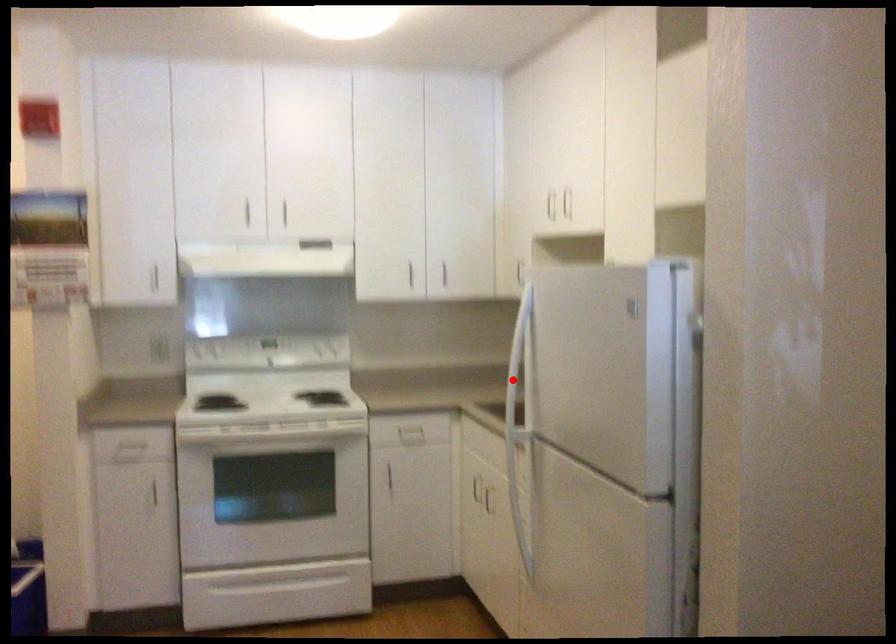
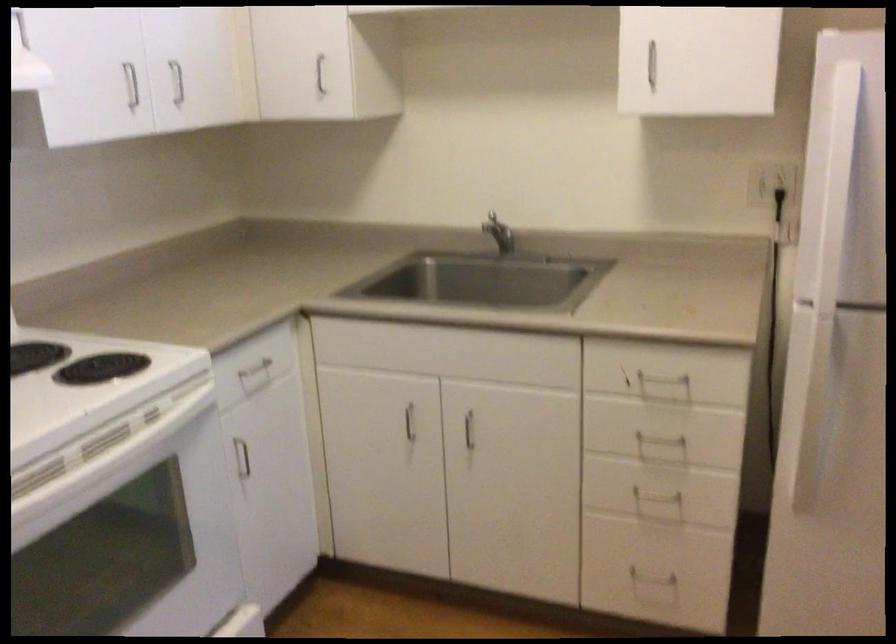
Question: A red point is marked in image1. In image2, is the corresponding 3D point closer to the camera or farther? Reply with the corresponding letter.

Choices:
 (A) The corresponding 3D point is closer.
 (B) The corresponding 3D point is farther.

Answer: (A)